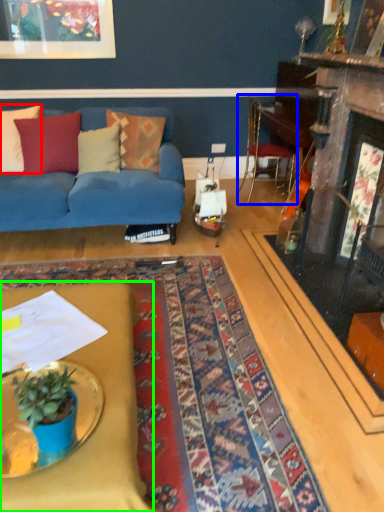
Question: Which object is the closest to the pillow (highlighted by a red box)? Choose among these: chair (highlighted by a blue box) or desk (highlighted by a green box).

Choices:
 (A) chair
 (B) desk

Answer: (B)